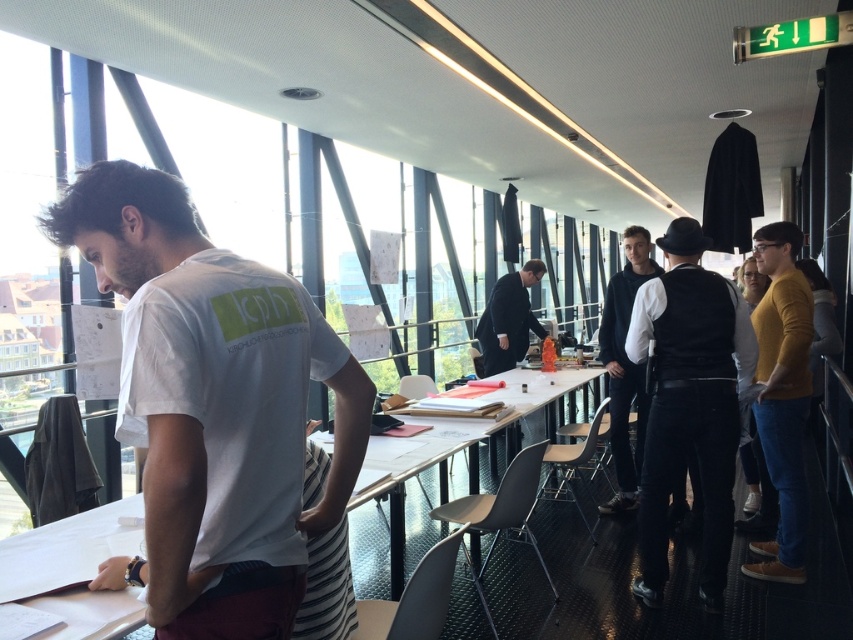
You are organizing a clothing display and need to arrange the black leather vest at center and mustard sweater at right based on their heights. Which one should you place on the higher shelf?

The black leather vest at center is much taller than the mustard sweater at right, so it should be placed on the higher shelf.

You are organizing a clothing display in the conference room and need to place the black leather vest at center and the black matte jacket at center on a rack. Which item should you place first if you want to ensure both fit on the rack without overlapping?

The black leather vest at center is smaller than the black matte jacket at center, so you should place the black matte jacket at center first to accommodate its larger size before adding the smaller vest.